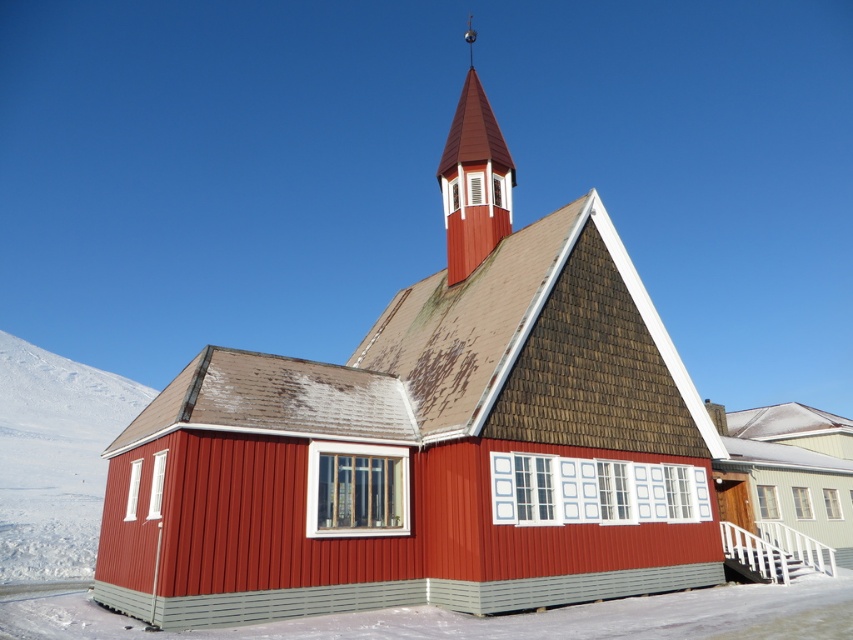
Between smooth wooden chapel at center and smooth red wood spire at upper center, which one is positioned higher?

Positioned higher is smooth red wood spire at upper center.

Can you confirm if smooth wooden chapel at center is wider than smooth red wood spire at upper center?

Yes, smooth wooden chapel at center is wider than smooth red wood spire at upper center.

Is point (247, 477) in front of point (473, 83)?

Yes.

Find the location of a particular element. The image size is (853, 640). smooth wooden chapel at center is located at coordinates (430, 440).